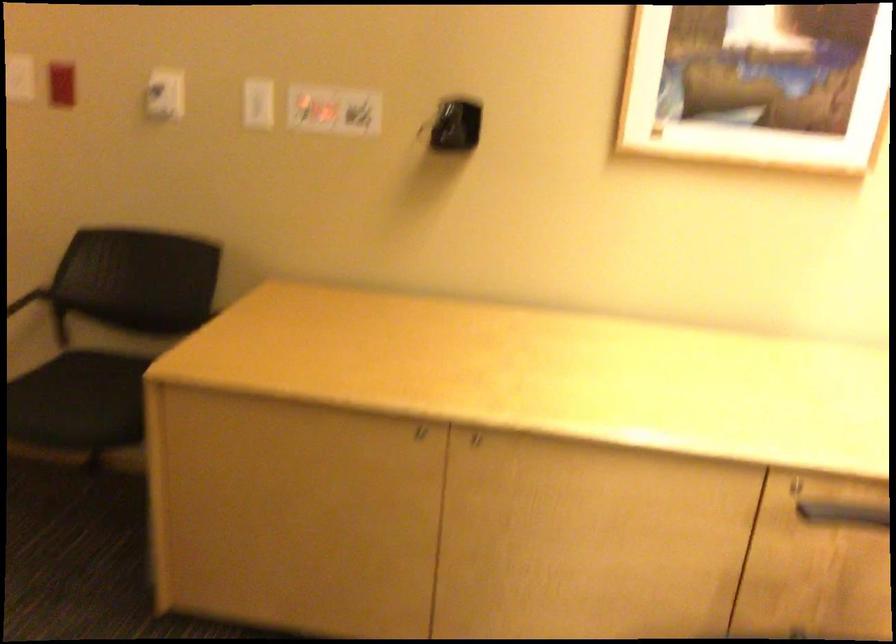
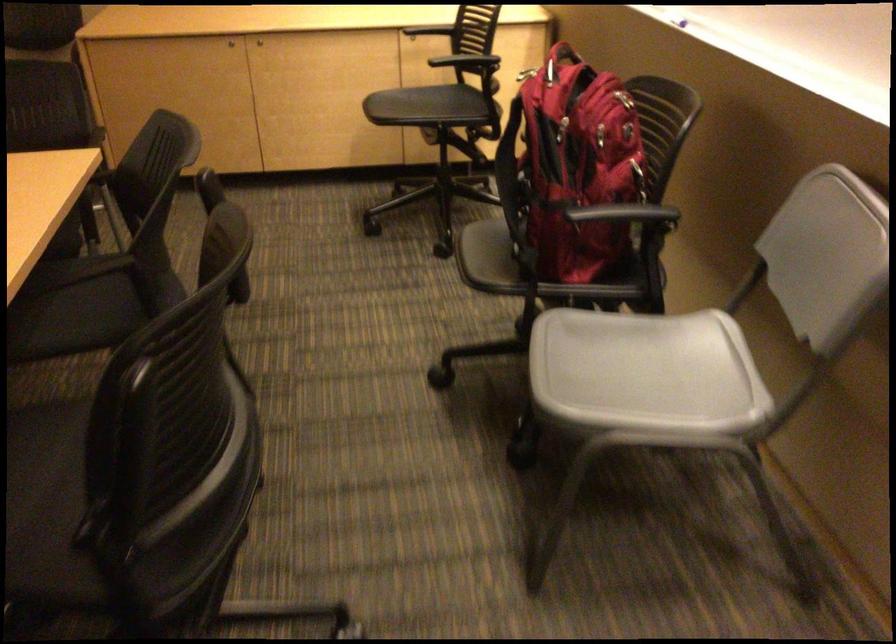
Find the pixel in the second image that matches pixel 442 460 in the first image.

(230, 44)